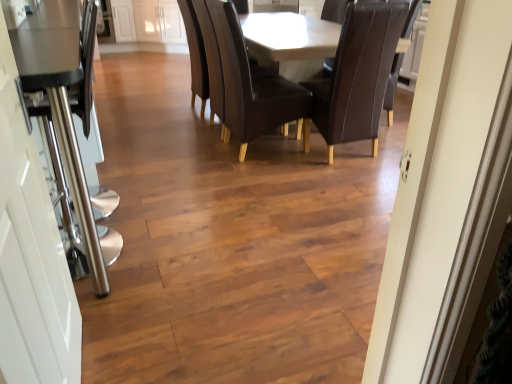
Locate an element on the screen. The image size is (512, 384). free space on the front side of brown leather chair at center, acting as the first chair starting from the left is located at coordinates (268, 180).